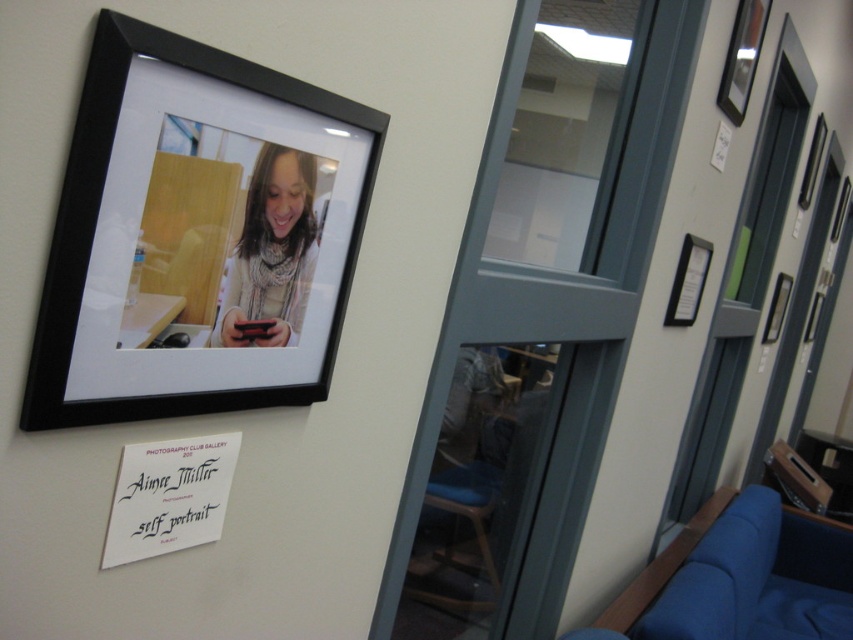
Question: Does matte black phone at center appear on the right side of matte black picture frame at upper right?

Choices:
 (A) yes
 (B) no

Answer: (B)

Question: Which object appears closest to the camera in this image?

Choices:
 (A) matte black picture frame at upper right
 (B) matte black phone at center

Answer: (B)

Question: Can you confirm if black matte picture frame at upper left is bigger than matte black phone at center?

Choices:
 (A) no
 (B) yes

Answer: (B)

Question: Which point appears closest to the camera in this image?

Choices:
 (A) (265, 304)
 (B) (752, 26)

Answer: (A)

Question: Which of the following is the closest to the observer?

Choices:
 (A) (315, 394)
 (B) (279, 294)

Answer: (B)

Question: Is the position of black matte picture frame at upper left more distant than that of matte black picture frame at upper right?

Choices:
 (A) yes
 (B) no

Answer: (B)